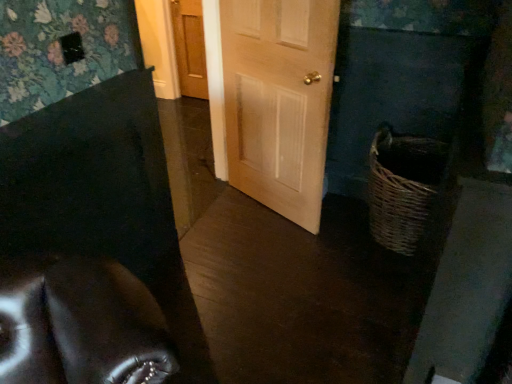
Question: Visually, is wooden door at center, positioned as the second door in front-to-back order, positioned to the left or to the right of woven brown basket at lower right?

Choices:
 (A) left
 (B) right

Answer: (A)

Question: From the image's perspective, is wooden door at center, the second door positioned from the right, located above or below woven brown basket at lower right?

Choices:
 (A) above
 (B) below

Answer: (A)

Question: Which object is positioned farthest from the woven brown basket at lower right?

Choices:
 (A) wooden door at center, the first door viewed from the top
 (B) light wood door at center, the 2th door positioned from the top

Answer: (A)

Question: Which object is positioned farthest from the light wood door at center, which is counted as the 1th door, starting from the right?

Choices:
 (A) wooden door at center, the first door when ordered from back to front
 (B) woven brown basket at lower right

Answer: (A)